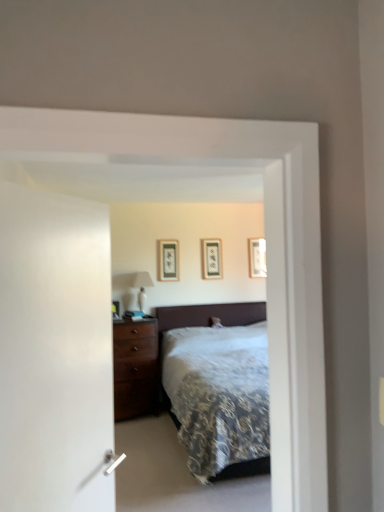
Describe the element at coordinates (257, 258) in the screenshot. This screenshot has height=512, width=384. I see `wooden picture frame at upper right, the 3th picture frame from the left` at that location.

Describe the element at coordinates (142, 287) in the screenshot. The image size is (384, 512). I see `white glossy table lamp at left` at that location.

Locate an element on the screen. This screenshot has height=512, width=384. wooden picture frame at upper right, the third picture frame in the front-to-back sequence is located at coordinates (257, 258).

Which is in front, point (137, 274) or point (175, 280)?

The point (137, 274) is closer.

Would you say white glossy table lamp at left is a long distance from matte black picture frame at center, which is counted as the 1th picture frame, starting from the left?

No, white glossy table lamp at left is not far away from matte black picture frame at center, which is counted as the 1th picture frame, starting from the left.

Considering their positions, is white glossy table lamp at left located in front of or behind matte black picture frame at center, the first picture frame positioned from the front?

Clearly, white glossy table lamp at left is in front of matte black picture frame at center, the first picture frame positioned from the front.

Considering the sizes of white glossy table lamp at left and matte black picture frame at center, acting as the 3th picture frame starting from the right, in the image, is white glossy table lamp at left wider or thinner than matte black picture frame at center, acting as the 3th picture frame starting from the right,?

Considering their sizes, white glossy table lamp at left looks broader than matte black picture frame at center, acting as the 3th picture frame starting from the right.

Considering the sizes of objects white glossy table lamp at left and matte black picture frame at center, placed as the second picture frame when sorted from front to back, in the image provided, who is thinner, white glossy table lamp at left or matte black picture frame at center, placed as the second picture frame when sorted from front to back,?

Thinner between the two is matte black picture frame at center, placed as the second picture frame when sorted from front to back.

Do you think white glossy table lamp at left is within matte black picture frame at center, placed as the second picture frame when sorted from front to back, or outside of it?

white glossy table lamp at left is outside matte black picture frame at center, placed as the second picture frame when sorted from front to back.

Is white glossy table lamp at left oriented away from matte black picture frame at center, the 2th picture frame from the back?

No, white glossy table lamp at left is not facing away from matte black picture frame at center, the 2th picture frame from the back.

Is white glossy table lamp at left not near matte black picture frame at center, the 2th picture frame when ordered from right to left?

That's right, there is a large distance between white glossy table lamp at left and matte black picture frame at center, the 2th picture frame when ordered from right to left.

Is wooden picture frame at upper right, the third picture frame in the front-to-back sequence, completely or partially outside of matte black picture frame at center, acting as the 3th picture frame starting from the right?

Yes, wooden picture frame at upper right, the third picture frame in the front-to-back sequence, is outside of matte black picture frame at center, acting as the 3th picture frame starting from the right.

Is wooden picture frame at upper right, which appears as the 1th picture frame when viewed from the back, in front of matte black picture frame at center, acting as the 3th picture frame starting from the right?

No, it is not.

From the image's perspective, is wooden picture frame at upper right, the third picture frame in the front-to-back sequence, above or below matte black picture frame at center, which is counted as the 1th picture frame, starting from the left?

From the image's perspective, wooden picture frame at upper right, the third picture frame in the front-to-back sequence, appears above matte black picture frame at center, which is counted as the 1th picture frame, starting from the left.

Based on their sizes in the image, would you say wooden picture frame at upper right, the third picture frame in the front-to-back sequence, is bigger or smaller than matte black picture frame at center, which is the third picture frame in back-to-front order?

Considering their sizes, wooden picture frame at upper right, the third picture frame in the front-to-back sequence, takes up less space than matte black picture frame at center, which is the third picture frame in back-to-front order.

Could you tell me if wooden picture frame at upper right, the 3th picture frame from the left, is facing white glossy table lamp at left?

No, wooden picture frame at upper right, the 3th picture frame from the left, is not facing towards white glossy table lamp at left.

Does wooden picture frame at upper right, marked as the first picture frame in a right-to-left arrangement, lie in front of white glossy table lamp at left?

No, it is not.

The height and width of the screenshot is (512, 384). I want to click on the 3rd picture frame above the white glossy table lamp at left (from the image's perspective), so click(x=257, y=258).

Is wooden picture frame at upper right, the 3th picture frame from the left, directly adjacent to white glossy table lamp at left?

No, wooden picture frame at upper right, the 3th picture frame from the left, is not in contact with white glossy table lamp at left.

Which picture frame is the 1st one when counting from the front of the wooden picture frame at upper right, which appears as the 1th picture frame when viewed from the back? Please provide its 2D coordinates.

[(212, 258)]

Does matte black picture frame at center, the 2th picture frame from the back, come in front of wooden picture frame at upper right, the 3th picture frame from the left?

Yes, the depth of matte black picture frame at center, the 2th picture frame from the back, is less than that of wooden picture frame at upper right, the 3th picture frame from the left.

What's the angular difference between matte black picture frame at center, the 2th picture frame when ordered from right to left, and wooden picture frame at upper right, the third picture frame in the front-to-back sequence,'s facing directions?

The angle between the facing direction of matte black picture frame at center, the 2th picture frame when ordered from right to left, and the facing direction of wooden picture frame at upper right, the third picture frame in the front-to-back sequence, is 0.00798 degrees.

From a real-world perspective, which is physically below, matte black picture frame at center, the 2th picture frame from the back, or wooden picture frame at upper right, marked as the first picture frame in a right-to-left arrangement?

matte black picture frame at center, the 2th picture frame from the back, is physically lower.

Looking at this image, is matte black picture frame at center, which is counted as the 1th picture frame, starting from the left, in front of wooden picture frame at upper right, the third picture frame in the front-to-back sequence?

Yes, the depth of matte black picture frame at center, which is counted as the 1th picture frame, starting from the left, is less than that of wooden picture frame at upper right, the third picture frame in the front-to-back sequence.

From a real-world perspective, does matte black picture frame at center, the first picture frame positioned from the front, stand above wooden picture frame at upper right, marked as the first picture frame in a right-to-left arrangement?

Yes, from a real-world perspective, matte black picture frame at center, the first picture frame positioned from the front, is on top of wooden picture frame at upper right, marked as the first picture frame in a right-to-left arrangement.

Is matte black picture frame at center, which is counted as the 1th picture frame, starting from the left, not close to wooden picture frame at upper right, marked as the first picture frame in a right-to-left arrangement?

Yes.

Is matte black picture frame at center, acting as the 3th picture frame starting from the right, positioned with its back to wooden picture frame at upper right, the third picture frame in the front-to-back sequence?

No, matte black picture frame at center, acting as the 3th picture frame starting from the right,'s orientation is not away from wooden picture frame at upper right, the third picture frame in the front-to-back sequence.

From a real-world perspective, is wooden picture frame at upper right, which appears as the 1th picture frame when viewed from the back, positioned above or below matte black picture frame at center, the 2th picture frame when ordered from right to left?

From a real-world perspective, wooden picture frame at upper right, which appears as the 1th picture frame when viewed from the back, is physically above matte black picture frame at center, the 2th picture frame when ordered from right to left.

Which of these two, wooden picture frame at upper right, the third picture frame in the front-to-back sequence, or matte black picture frame at center, placed as the second picture frame when sorted from front to back, stands taller?

With more height is matte black picture frame at center, placed as the second picture frame when sorted from front to back.

From the image's perspective, which is below, wooden picture frame at upper right, the 3th picture frame from the left, or matte black picture frame at center, the 2th picture frame from the back?

matte black picture frame at center, the 2th picture frame from the back, is shown below in the image.

Looking at this image, could you tell me if wooden picture frame at upper right, the third picture frame in the front-to-back sequence, is facing matte black picture frame at center, placed as the second picture frame when sorted from front to back?

No, wooden picture frame at upper right, the third picture frame in the front-to-back sequence, is not turned towards matte black picture frame at center, placed as the second picture frame when sorted from front to back.

What are the coordinates of `table lamp below the matte black picture frame at center, the first picture frame positioned from the front (from the image's perspective)` in the screenshot? It's located at (142, 287).

Locate an element on the screen. This screenshot has height=512, width=384. table lamp below the matte black picture frame at center, the 2th picture frame from the back (from a real-world perspective) is located at coordinates (142, 287).

Looking at the image, which one is located closer to matte black picture frame at center, the second picture frame positioned from the left, white glossy table lamp at left or wooden picture frame at upper right, the 3th picture frame from the left?

The object closer to matte black picture frame at center, the second picture frame positioned from the left, is wooden picture frame at upper right, the 3th picture frame from the left.

Estimate the real-world distances between objects in this image. Which object is further from matte black picture frame at center, which is counted as the 1th picture frame, starting from the left, matte black picture frame at center, the second picture frame positioned from the left, or wooden picture frame at upper right, the 3th picture frame from the left?

wooden picture frame at upper right, the 3th picture frame from the left, is positioned further to the anchor matte black picture frame at center, which is counted as the 1th picture frame, starting from the left.

From the image, which object appears to be farther from matte black picture frame at center, the second picture frame positioned from the left, matte black picture frame at center, which is counted as the 1th picture frame, starting from the left, or wooden picture frame at upper right, which appears as the 1th picture frame when viewed from the back?

Based on the image, wooden picture frame at upper right, which appears as the 1th picture frame when viewed from the back, appears to be further to matte black picture frame at center, the second picture frame positioned from the left.

Considering their positions, is wooden picture frame at upper right, the third picture frame in the front-to-back sequence, positioned closer to matte black picture frame at center, acting as the 3th picture frame starting from the right, than white glossy table lamp at left?

white glossy table lamp at left is closer to matte black picture frame at center, acting as the 3th picture frame starting from the right.

Which object lies further to the anchor point matte black picture frame at center, which is counted as the 1th picture frame, starting from the left, white glossy table lamp at left or matte black picture frame at center, placed as the second picture frame when sorted from front to back?

Based on the image, matte black picture frame at center, placed as the second picture frame when sorted from front to back, appears to be further to matte black picture frame at center, which is counted as the 1th picture frame, starting from the left.

Considering their positions, is matte black picture frame at center, the 2th picture frame from the back, positioned closer to white glossy table lamp at left than wooden picture frame at upper right, marked as the first picture frame in a right-to-left arrangement?

Among the two, matte black picture frame at center, the 2th picture frame from the back, is located nearer to white glossy table lamp at left.

Considering their positions, is matte black picture frame at center, placed as the second picture frame when sorted from front to back, positioned closer to matte black picture frame at center, the first picture frame positioned from the front, than white glossy table lamp at left?

The object closer to matte black picture frame at center, the first picture frame positioned from the front, is white glossy table lamp at left.

Based on their spatial positions, is wooden picture frame at upper right, marked as the first picture frame in a right-to-left arrangement, or matte black picture frame at center, the first picture frame positioned from the front, closer to white glossy table lamp at left?

matte black picture frame at center, the first picture frame positioned from the front.

The height and width of the screenshot is (512, 384). Identify the location of picture frame located between matte black picture frame at center, which is the third picture frame in back-to-front order, and wooden picture frame at upper right, marked as the first picture frame in a right-to-left arrangement, in the left-right direction. (212, 258).

Locate an element on the screen. This screenshot has height=512, width=384. picture frame located between white glossy table lamp at left and matte black picture frame at center, the second picture frame positioned from the left, in the left-right direction is located at coordinates (168, 260).